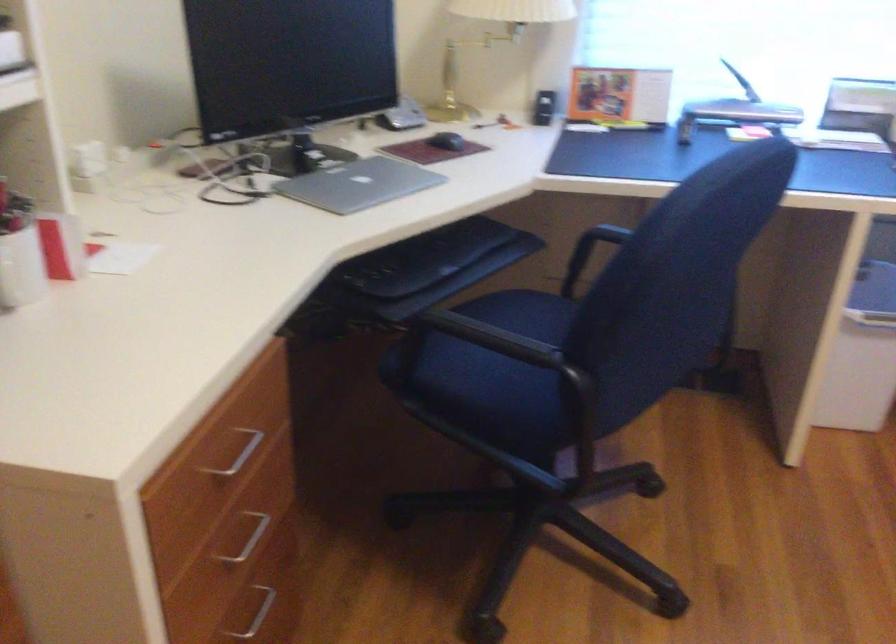
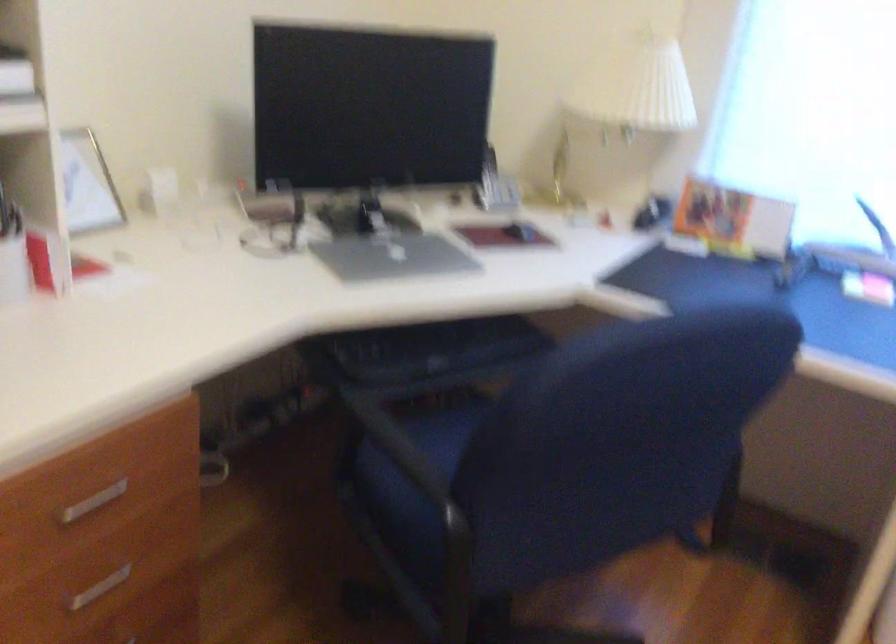
Question: Which direction would the cameraman need to move to produce the second image? Reply with the corresponding letter.

Choices:
 (A) Left
 (B) Right
 (C) Forward
 (D) Backward

Answer: (B)